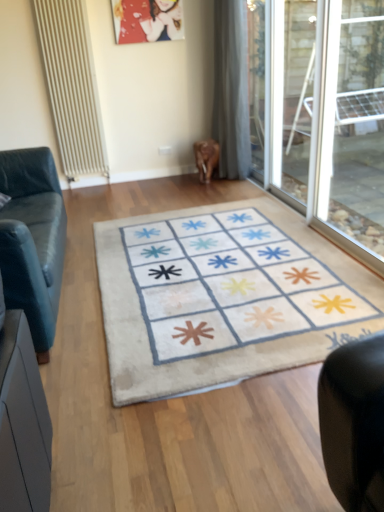
Image resolution: width=384 pixels, height=512 pixels. Find the location of `free spot in front of beige textured radiator at left`. free spot in front of beige textured radiator at left is located at coordinates (85, 195).